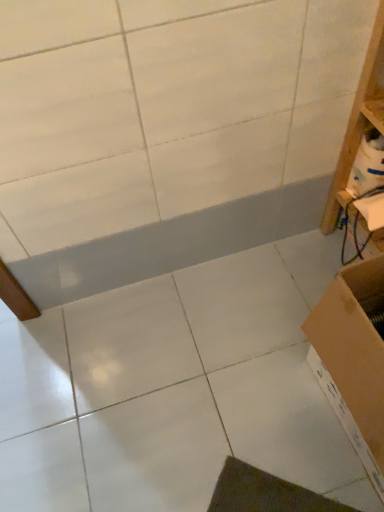
The height and width of the screenshot is (512, 384). Describe the element at coordinates (353, 358) in the screenshot. I see `brown cardboard box at lower right` at that location.

The height and width of the screenshot is (512, 384). Find the location of `brown cardboard box at lower right`. brown cardboard box at lower right is located at coordinates (353, 358).

Image resolution: width=384 pixels, height=512 pixels. What are the coordinates of `brown cardboard box at lower right` in the screenshot? It's located at (353, 358).